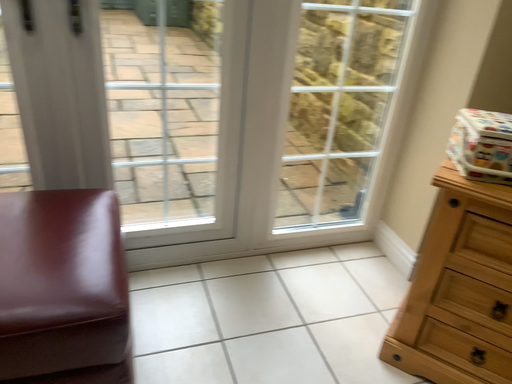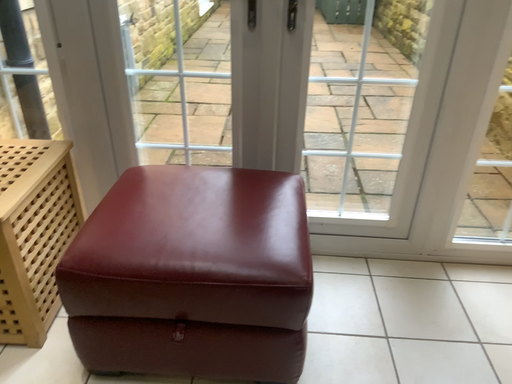
Question: How did the camera likely rotate when shooting the video?

Choices:
 (A) rotated left
 (B) rotated right

Answer: (A)